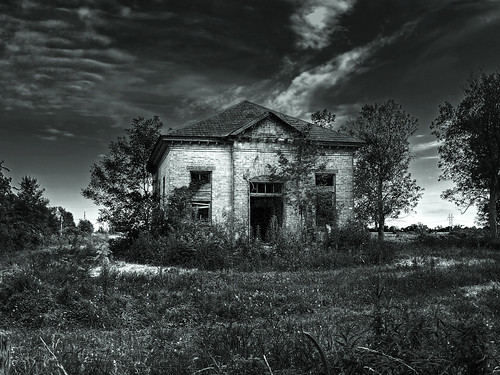
You are a GUI agent. You are given a task and a screenshot of the screen. Output one action in this format:
    pyautogui.click(x=<x>, y=<y>)
    Task: Click on the long rectangular window on right
    The image size is (500, 375).
    Given the screenshot: What is the action you would take?
    pyautogui.click(x=326, y=218)